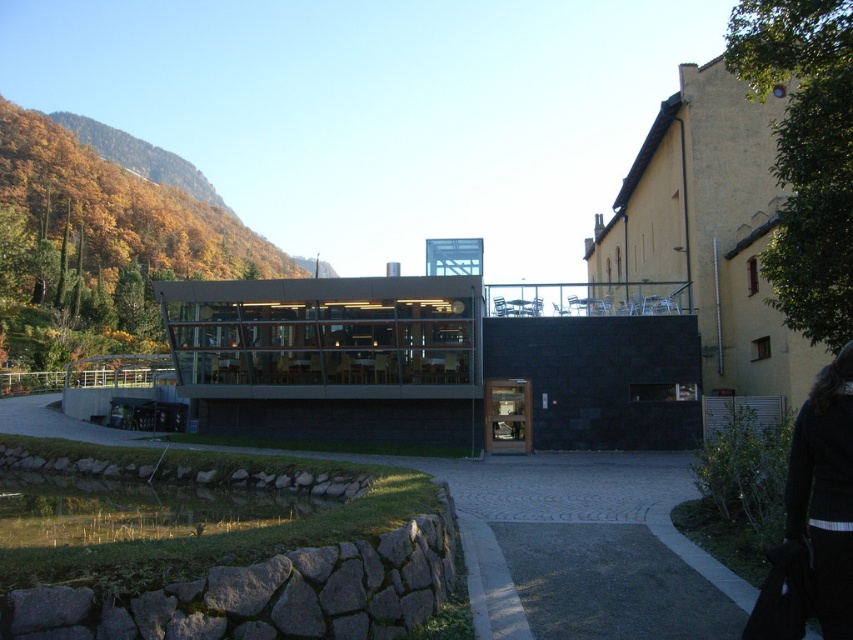
You are standing in front of the modern building and want to walk to the black fabric at lower right. Which direction should you move relative to the paved stone path at center?

You should move away from the paved stone path at center since it is closer to you than the black fabric at lower right, meaning the black fabric is behind the path.

You are standing at the entrance of the modern building and want to walk to the traditional yellow building. Is the point marked by point (582, 547) on a paved stone path or on grass?

The point marked by point (582, 547) is on paved stone path at center, so yes, it is on a paved stone path.

You are a visitor approaching the modern building and notice the paved stone path at center and the black fabric at lower right. Which object is positioned lower in the scene?

The paved stone path at center is positioned below the black fabric at lower right, so it is lower in the scene.